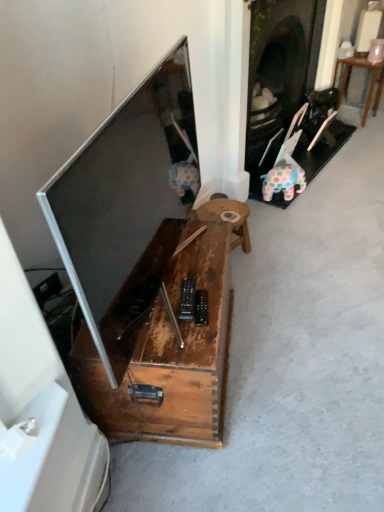
Image resolution: width=384 pixels, height=512 pixels. Describe the element at coordinates (122, 196) in the screenshot. I see `matte black tv at left` at that location.

The height and width of the screenshot is (512, 384). In order to click on matte black tv at left in this screenshot , I will do `click(122, 196)`.

I want to click on matte black tv at left, so click(122, 196).

Considering the relative sizes of matte black tv at left and wooden table at right, the first table in the back-to-front sequence, in the image provided, is matte black tv at left smaller than wooden table at right, the first table in the back-to-front sequence,?

Actually, matte black tv at left might be larger than wooden table at right, the first table in the back-to-front sequence.

In the scene shown: Based on their positions, is matte black tv at left located to the left or right of wooden table at right, the first table in the back-to-front sequence?

matte black tv at left is to the left of wooden table at right, the first table in the back-to-front sequence.

Locate an element on the screen. The height and width of the screenshot is (512, 384). television above the wooden table at right, the first table in the back-to-front sequence (from a real-world perspective) is located at coordinates (122, 196).

Could you tell me if matte black tv at left is facing wooden table at right, the first table in the back-to-front sequence?

No, matte black tv at left is not aimed at wooden table at right, the first table in the back-to-front sequence.

Considering the sizes of matte black tv at left and rustic wood coffee table at center in the image, is matte black tv at left bigger or smaller than rustic wood coffee table at center?

Considering their sizes, matte black tv at left takes up less space than rustic wood coffee table at center.

From the image's perspective, does matte black tv at left appear higher than rustic wood coffee table at center?

Correct, matte black tv at left appears higher than rustic wood coffee table at center in the image.

Considering the sizes of matte black tv at left and rustic wood coffee table at center in the image, is matte black tv at left wider or thinner than rustic wood coffee table at center?

Clearly, matte black tv at left has less width compared to rustic wood coffee table at center.

Is matte black tv at left shorter than rustic wood coffee table at center?

No, matte black tv at left is not shorter than rustic wood coffee table at center.

How far apart are matte black tv at left and rustic wood table at center, positioned as the 1th table in bottom-to-top order?

matte black tv at left and rustic wood table at center, positioned as the 1th table in bottom-to-top order, are 28.38 inches apart from each other.

Is rustic wood table at center, the 2th table in the top-to-bottom sequence, completely or partially inside matte black tv at left?

No, matte black tv at left does not contain rustic wood table at center, the 2th table in the top-to-bottom sequence.

This screenshot has height=512, width=384. I want to click on television above the rustic wood table at center, the 1th table when ordered from front to back (from a real-world perspective), so click(122, 196).

From the image's perspective, which is above, matte black tv at left or rustic wood table at center, the 2th table in the top-to-bottom sequence?

From the image's view, matte black tv at left is above.

Is rustic wood table at center, the 2th table in the top-to-bottom sequence, to the right of rustic wood coffee table at center from the viewer's perspective?

Correct, you'll find rustic wood table at center, the 2th table in the top-to-bottom sequence, to the right of rustic wood coffee table at center.

From a real-world perspective, is rustic wood table at center, which is counted as the second table, starting from the right, on rustic wood coffee table at center?

Actually, rustic wood table at center, which is counted as the second table, starting from the right, is physically below rustic wood coffee table at center in the real world.

Can you tell me how much rustic wood table at center, positioned as the 1th table in bottom-to-top order, and rustic wood coffee table at center differ in facing direction?

There is a 32.8-degree angle between the facing directions of rustic wood table at center, positioned as the 1th table in bottom-to-top order, and rustic wood coffee table at center.

Is point (199, 207) behind point (172, 418)?

Yes, point (199, 207) is farther from viewer.

Does rustic wood table at center, which is counted as the second table, starting from the right, contain matte black tv at left?

No, rustic wood table at center, which is counted as the second table, starting from the right, does not contain matte black tv at left.

Could you tell me if rustic wood table at center, the 1th table when ordered from front to back, is turned towards matte black tv at left?

No, rustic wood table at center, the 1th table when ordered from front to back, does not turn towards matte black tv at left.

From a real-world perspective, starting from the matte black tv at left, which table is the 2nd one below it? Please provide its 2D coordinates.

[(228, 218)]

Which point is more distant from viewer, (368,67) or (244,230)?

The point (368,67) is more distant.

Based on their sizes in the image, would you say wooden table at right, which is the second table in bottom-to-top order, is bigger or smaller than rustic wood table at center, the 2th table in the top-to-bottom sequence?

In the image, wooden table at right, which is the second table in bottom-to-top order, appears to be larger than rustic wood table at center, the 2th table in the top-to-bottom sequence.

Is rustic wood table at center, which is counted as the second table, starting from the right, inside wooden table at right, the first table in the back-to-front sequence?

No, wooden table at right, the first table in the back-to-front sequence, does not contain rustic wood table at center, which is counted as the second table, starting from the right.

From a real-world perspective, is wooden table at right, the first table positioned from the right, positioned under rustic wood table at center, which appears as the first table when viewed from the left, based on gravity?

No, from a real-world perspective, wooden table at right, the first table positioned from the right, is not under rustic wood table at center, which appears as the first table when viewed from the left.

From a real-world perspective, is wooden table at right, the first table in the back-to-front sequence, under rustic wood coffee table at center?

Yes, from a real-world perspective, wooden table at right, the first table in the back-to-front sequence, is beneath rustic wood coffee table at center.

Which of these two, wooden table at right, the second table viewed from the left, or rustic wood coffee table at center, is thinner?

wooden table at right, the second table viewed from the left.

Is wooden table at right, placed as the first table when sorted from top to bottom, positioned with its back to rustic wood coffee table at center?

No, wooden table at right, placed as the first table when sorted from top to bottom, is not facing the opposite direction of rustic wood coffee table at center.

Between wooden table at right, placed as the first table when sorted from top to bottom, and rustic wood coffee table at center, which one has more height?

wooden table at right, placed as the first table when sorted from top to bottom, is taller.

At what (x,y) coordinates should I click in order to perform the action: click on television lying in front of the wooden table at right, the second table from the front. Please return your answer as a coordinate pair (x, y). The width and height of the screenshot is (384, 512). Looking at the image, I should click on (122, 196).

Locate an element on the screen. This screenshot has width=384, height=512. furniture below the matte black tv at left (from the image's perspective) is located at coordinates (163, 345).

Based on their spatial positions, is matte black tv at left or rustic wood table at center, the 1th table when ordered from front to back, closer to wooden table at right, placed as the first table when sorted from top to bottom?

rustic wood table at center, the 1th table when ordered from front to back, is positioned closer to the anchor wooden table at right, placed as the first table when sorted from top to bottom.

Considering their positions, is rustic wood coffee table at center positioned further to wooden table at right, the second table from the front, than rustic wood table at center, which is counted as the second table, starting from the right?

The object further to wooden table at right, the second table from the front, is rustic wood coffee table at center.

Which object lies further to the anchor point rustic wood coffee table at center, matte black tv at left or rustic wood table at center, which appears as the first table when viewed from the left?

rustic wood table at center, which appears as the first table when viewed from the left.

Looking at the image, which one is located closer to rustic wood coffee table at center, matte black tv at left or wooden table at right, the second table viewed from the left?

matte black tv at left lies closer to rustic wood coffee table at center than the other object.

When comparing their distances from rustic wood table at center, the 1th table when ordered from front to back, does wooden table at right, the second table from the front, or matte black tv at left seem closer?

matte black tv at left is closer to rustic wood table at center, the 1th table when ordered from front to back.

In the scene shown: Estimate the real-world distances between objects in this image. Which object is further from wooden table at right, the second table viewed from the left, matte black tv at left or rustic wood coffee table at center?

The object further to wooden table at right, the second table viewed from the left, is rustic wood coffee table at center.

From the image, which object appears to be farther from matte black tv at left, rustic wood table at center, which is counted as the second table, starting from the right, or rustic wood coffee table at center?

rustic wood table at center, which is counted as the second table, starting from the right, is further to matte black tv at left.

From the image, which object appears to be farther from wooden table at right, which is the second table in bottom-to-top order, rustic wood table at center, the 1th table when ordered from front to back, or rustic wood coffee table at center?

rustic wood coffee table at center.

Find the location of a particular element. The image size is (384, 512). table between matte black tv at left and wooden table at right, the first table positioned from the right, in the front-back direction is located at coordinates (228, 218).

The height and width of the screenshot is (512, 384). I want to click on table between rustic wood coffee table at center and wooden table at right, the second table viewed from the left, along the z-axis, so click(228, 218).

Identify the location of furniture located between matte black tv at left and rustic wood table at center, the 1th table when ordered from front to back, in the depth direction. The height and width of the screenshot is (512, 384). (163, 345).

Locate an element on the screen. furniture between matte black tv at left and wooden table at right, the first table in the back-to-front sequence, along the z-axis is located at coordinates (163, 345).